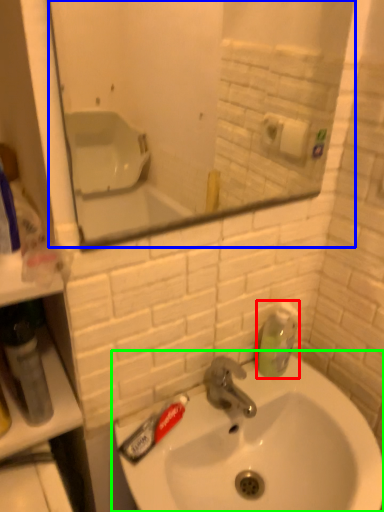
Question: Which is farther away from soap dispenser (highlighted by a red box)? mirror (highlighted by a blue box) or sink (highlighted by a green box)?

Choices:
 (A) mirror
 (B) sink

Answer: (A)